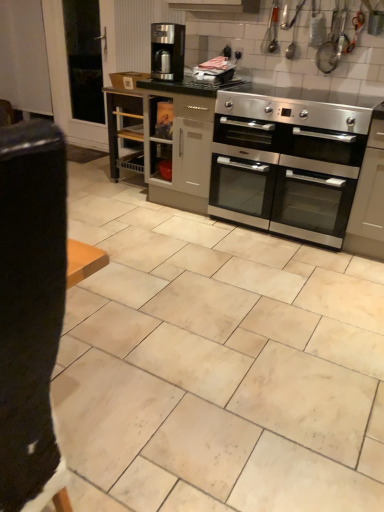
Question: Do you think stainless steel oven at center is within satin grey cabinet at center, or outside of it?

Choices:
 (A) outside
 (B) inside

Answer: (A)

Question: From the image's perspective, is stainless steel oven at center positioned above or below satin grey cabinet at center?

Choices:
 (A) below
 (B) above

Answer: (B)

Question: Which is nearer to the satin grey cabinet at center?

Choices:
 (A) satin black coffee maker at center
 (B) beige matte tile at center
 (C) stainless steel oven at center
 (D) stainless steel oven at center
 (E) transparent glass door at upper left

Answer: (A)

Question: Which is farther from the satin grey cabinet at center?

Choices:
 (A) transparent glass door at upper left
 (B) stainless steel oven at center
 (C) stainless steel oven at center
 (D) satin black coffee maker at center
 (E) beige matte tile at center

Answer: (A)